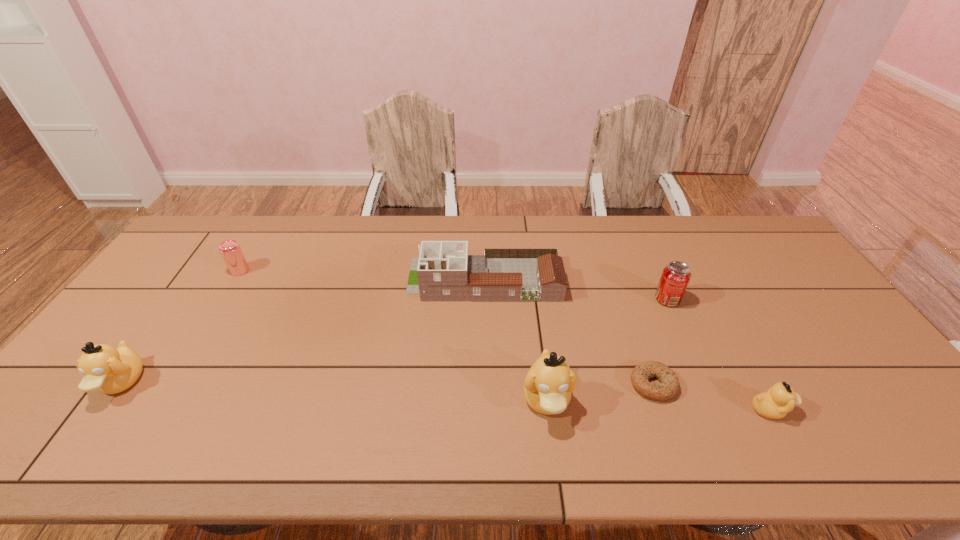
The image size is (960, 540). Identify the location of bagel. (669, 386).

The width and height of the screenshot is (960, 540). Find the location of `free location located on the face of the rightmost object`. free location located on the face of the rightmost object is located at coordinates (821, 409).

Find the location of a particular element. vacant space located 0.270m at the main entrance of the dollhouse is located at coordinates (324, 280).

In order to click on vacant area situated at the main entrance of the dollhouse in this screenshot , I will do `click(326, 280)`.

Locate an element on the screen. vacant space positioned at the main entrance of the dollhouse is located at coordinates (393, 280).

You are a GUI agent. You are given a task and a screenshot of the screen. Output one action in this format:
    pyautogui.click(x=<x>, y=<y>)
    Task: Click on the vacant space located on the back of the beer can
    This screenshot has height=540, width=960.
    Given the screenshot: What is the action you would take?
    pyautogui.click(x=255, y=246)

At what (x,y) coordinates should I click in order to perform the action: click on blank space located on the left of the sixth object from left to right. Please return your answer as a coordinate pair (x, y). The image size is (960, 540). Looking at the image, I should click on (602, 299).

The height and width of the screenshot is (540, 960). Find the location of `free space located 0.190m on the left of the bagel`. free space located 0.190m on the left of the bagel is located at coordinates (555, 384).

You are a GUI agent. You are given a task and a screenshot of the screen. Output one action in this format:
    pyautogui.click(x=<x>, y=<y>)
    Task: Click on the bagel that is at the near edge
    
    Given the screenshot: What is the action you would take?
    pyautogui.click(x=669, y=386)

Locate an element on the screen. The image size is (960, 540). object located in the left edge section of the desktop is located at coordinates (109, 370).